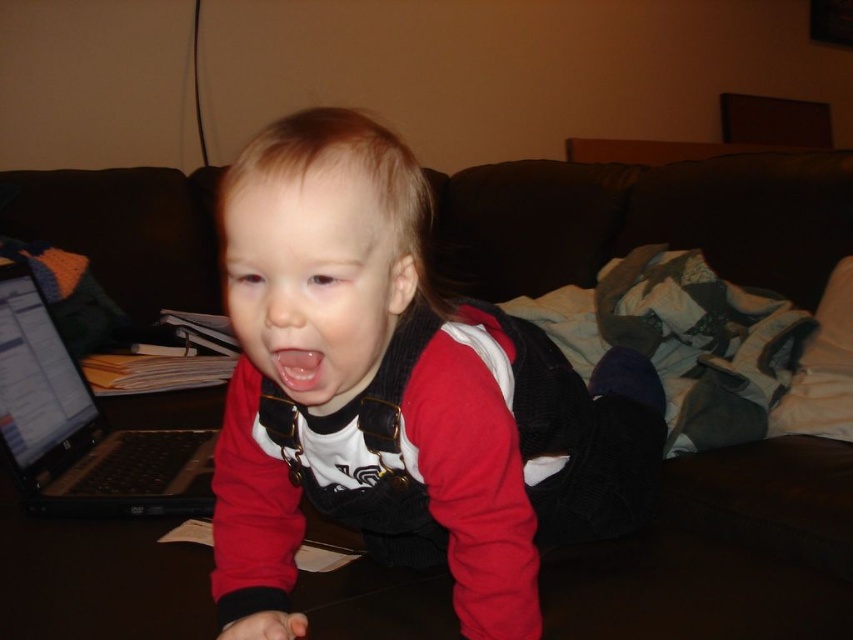
Can you confirm if red matte vest at center is positioned below clear pink flesh at center?

Yes.

Is red matte vest at center further to the viewer compared to clear pink flesh at center?

That is False.

The image size is (853, 640). I want to click on red matte vest at center, so tap(399, 396).

Who is positioned more to the right, black plastic laptop at left or clear pink flesh at center?

clear pink flesh at center

Looking at this image, is black plastic laptop at left to the right of clear pink flesh at center from the viewer's perspective?

No, black plastic laptop at left is not to the right of clear pink flesh at center.

Is point (109, 477) positioned in front of point (296, 396)?

No, it is not.

Find the location of a particular element. black plastic laptop at left is located at coordinates (82, 428).

Does red matte vest at center come in front of black plastic laptop at left?

That is True.

Who is lower down, red matte vest at center or black plastic laptop at left?

red matte vest at center

Does point (540, 362) come in front of point (128, 497)?

Yes.

The height and width of the screenshot is (640, 853). What are the coordinates of `red matte vest at center` in the screenshot? It's located at (399, 396).